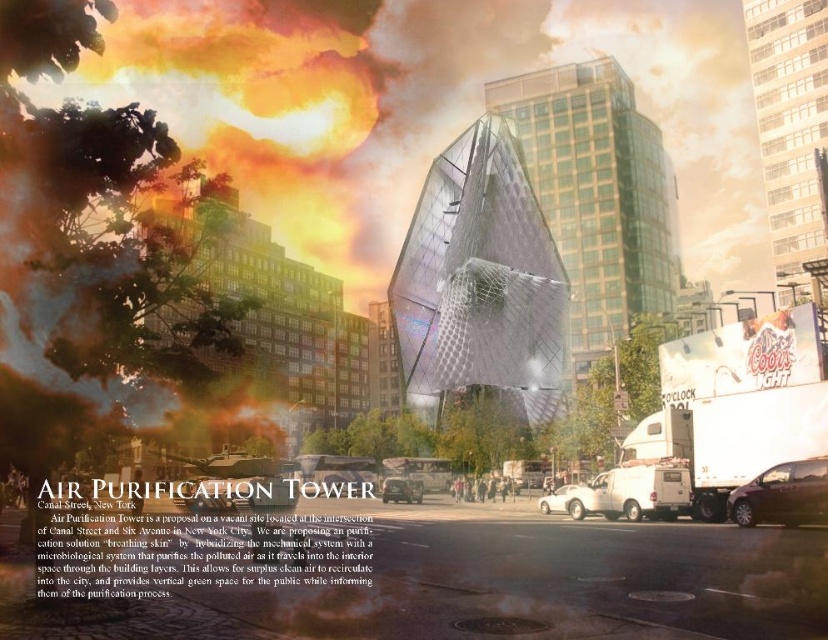
Question: Which of the following is the closest to the observer?

Choices:
 (A) white matte car at center
 (B) shiny silver minivan at lower right

Answer: (B)

Question: Is shiny silver minivan at lower right smaller than white matte car at center?

Choices:
 (A) no
 (B) yes

Answer: (B)

Question: Is shiny silver minivan at lower right wider than white matte car at center?

Choices:
 (A) yes
 (B) no

Answer: (B)

Question: Can you confirm if metallic silver car at center is positioned above white matte car at center?

Choices:
 (A) no
 (B) yes

Answer: (A)

Question: Estimate the real-world distances between objects in this image. Which object is closer to the metallic silver car at center?

Choices:
 (A) shiny silver minivan at lower right
 (B) white matte car at center

Answer: (B)

Question: Estimate the real-world distances between objects in this image. Which object is closer to the white matte car at center?

Choices:
 (A) shiny silver minivan at lower right
 (B) metallic silver car at center

Answer: (B)